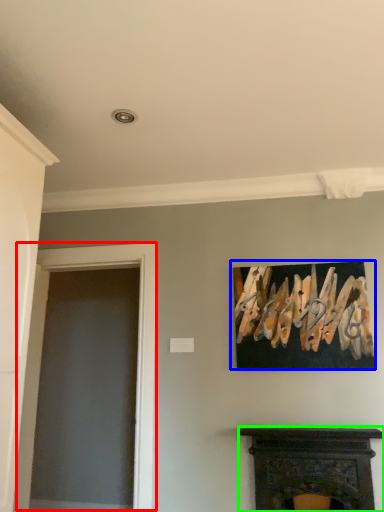
Question: Estimate the real-world distances between objects in this image. Which object is farther from glass door (highlighted by a red box), picture frame (highlighted by a blue box) or fireplace (highlighted by a green box)?

Choices:
 (A) picture frame
 (B) fireplace

Answer: (B)